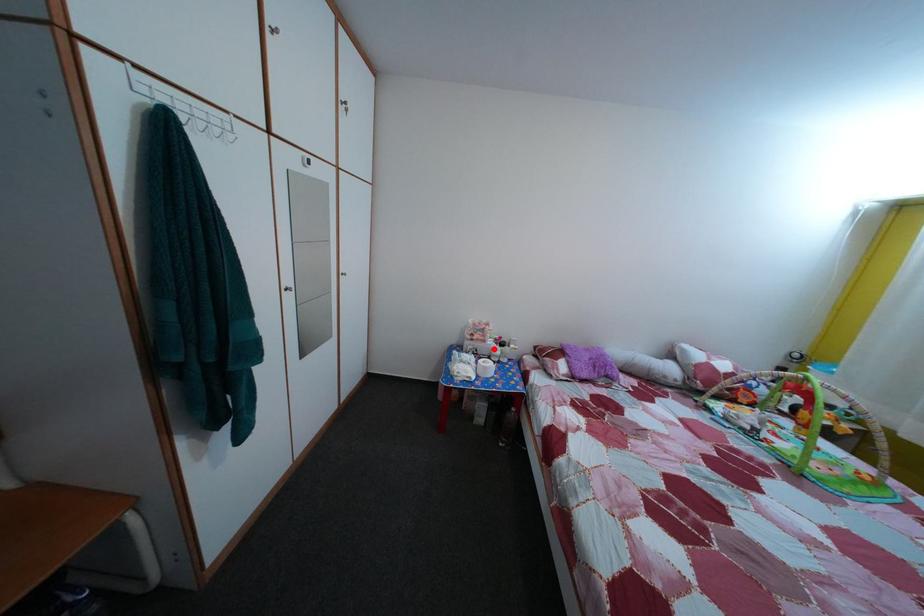
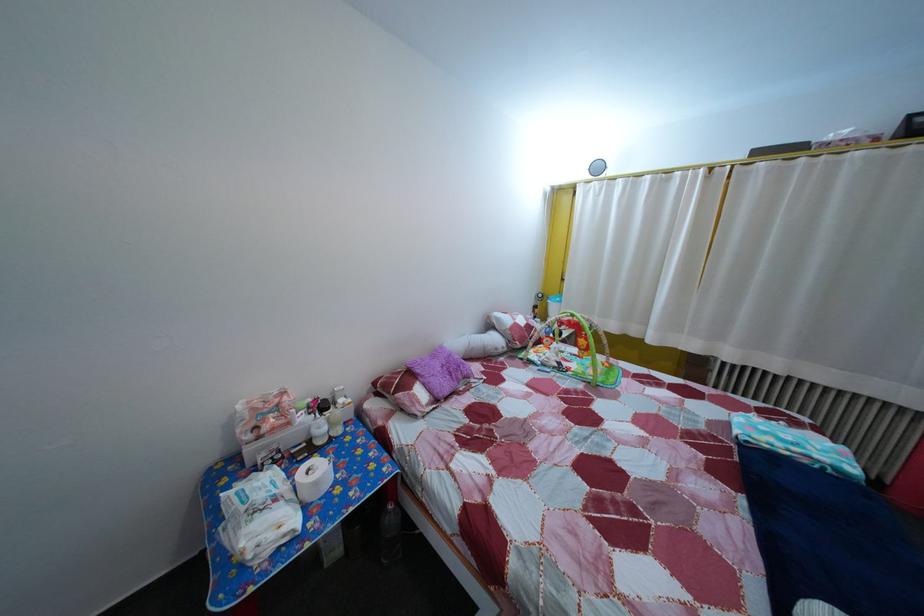
Question: I am providing you with two images of the same scene from different viewpoints. Given a red point in image1, look at the same physical point in image2. Is it:

Choices:
 (A) Closer to the viewpoint
 (B) Farther from the viewpoint

Answer: (A)